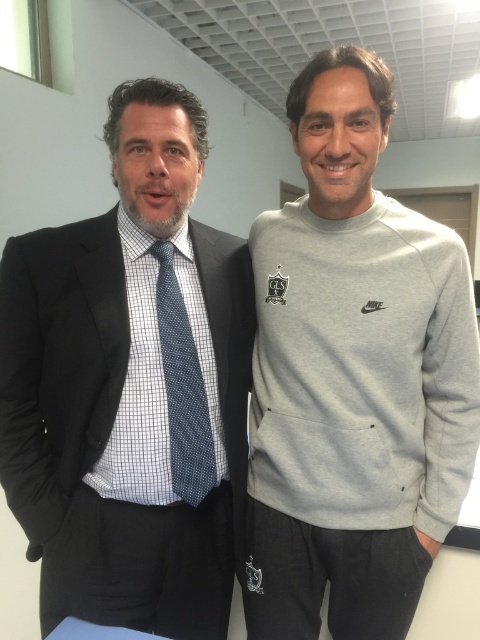
Question: Which point is farther from the camera taking this photo?

Choices:
 (A) click(x=343, y=582)
 (B) click(x=213, y=444)
 (C) click(x=235, y=525)

Answer: (A)

Question: Among these points, which one is farthest from the camera?

Choices:
 (A) (56, 566)
 (B) (177, 481)

Answer: (A)

Question: Which point is closer to the camera?

Choices:
 (A) gray fleece sweatshirt at right
 (B) blue dotted tie at center
 (C) matte black suit at left

Answer: (C)

Question: Does matte black suit at left have a smaller size compared to gray fleece sweatshirt at right?

Choices:
 (A) yes
 (B) no

Answer: (B)

Question: Observing the image, what is the correct spatial positioning of gray fleece sweatshirt at right in reference to blue dotted tie at center?

Choices:
 (A) below
 (B) above

Answer: (A)

Question: Is matte black suit at left behind gray fleece sweatshirt at right?

Choices:
 (A) no
 (B) yes

Answer: (A)